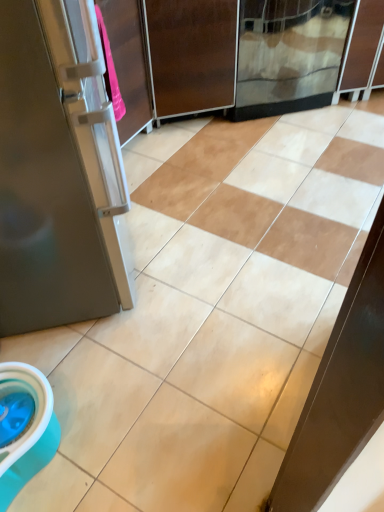
Find the location of `transparent glass screen door at upper center, the 2th screen door from the left`. transparent glass screen door at upper center, the 2th screen door from the left is located at coordinates (288, 55).

The image size is (384, 512). What do you see at coordinates (288, 55) in the screenshot? I see `transparent glass screen door at upper center, the 1th screen door positioned from the right` at bounding box center [288, 55].

In order to face transparent glass screen door at upper center, the 2th screen door from the left, should I rotate leftwards or rightwards?

Rotate right and turn 10.759 degrees.

Where is `brown matte screen door at center, placed as the 1th screen door when sorted from left to right`? This screenshot has height=512, width=384. brown matte screen door at center, placed as the 1th screen door when sorted from left to right is located at coordinates (192, 55).

Image resolution: width=384 pixels, height=512 pixels. Describe the element at coordinates (192, 55) in the screenshot. I see `brown matte screen door at center, arranged as the 2th screen door when viewed from the right` at that location.

Find the location of `transparent glass screen door at upper center, the 1th screen door positioned from the right`. transparent glass screen door at upper center, the 1th screen door positioned from the right is located at coordinates (288, 55).

From the picture: Is transparent glass screen door at upper center, the 1th screen door positioned from the right, at the right side of brown matte screen door at center, placed as the 1th screen door when sorted from left to right?

Yes, transparent glass screen door at upper center, the 1th screen door positioned from the right, is to the right of brown matte screen door at center, placed as the 1th screen door when sorted from left to right.

Considering the relative positions of transparent glass screen door at upper center, the 1th screen door positioned from the right, and brown matte screen door at center, arranged as the 2th screen door when viewed from the right, in the image provided, is transparent glass screen door at upper center, the 1th screen door positioned from the right, behind brown matte screen door at center, arranged as the 2th screen door when viewed from the right,?

Yes, the depth of transparent glass screen door at upper center, the 1th screen door positioned from the right, is greater than that of brown matte screen door at center, arranged as the 2th screen door when viewed from the right.

Is point (272, 25) farther from camera compared to point (214, 85)?

No, (272, 25) is in front of (214, 85).

From the image's perspective, does transparent glass screen door at upper center, the 1th screen door positioned from the right, appear higher than brown matte screen door at center, arranged as the 2th screen door when viewed from the right?

Yes, from the image's perspective, transparent glass screen door at upper center, the 1th screen door positioned from the right, is on top of brown matte screen door at center, arranged as the 2th screen door when viewed from the right.

From a real-world perspective, is transparent glass screen door at upper center, the 1th screen door positioned from the right, positioned above or below brown matte screen door at center, arranged as the 2th screen door when viewed from the right?

transparent glass screen door at upper center, the 1th screen door positioned from the right, is below brown matte screen door at center, arranged as the 2th screen door when viewed from the right.

Is transparent glass screen door at upper center, the 1th screen door positioned from the right, wider than brown matte screen door at center, arranged as the 2th screen door when viewed from the right?

No, transparent glass screen door at upper center, the 1th screen door positioned from the right, is not wider than brown matte screen door at center, arranged as the 2th screen door when viewed from the right.

Looking at this image, is transparent glass screen door at upper center, the 1th screen door positioned from the right, taller than brown matte screen door at center, placed as the 1th screen door when sorted from left to right?

In fact, transparent glass screen door at upper center, the 1th screen door positioned from the right, may be shorter than brown matte screen door at center, placed as the 1th screen door when sorted from left to right.

Who is bigger, transparent glass screen door at upper center, the 2th screen door from the left, or brown matte screen door at center, arranged as the 2th screen door when viewed from the right?

Bigger between the two is transparent glass screen door at upper center, the 2th screen door from the left.

Is brown matte screen door at center, arranged as the 2th screen door when viewed from the right, inside transparent glass screen door at upper center, the 2th screen door from the left?

That's incorrect, brown matte screen door at center, arranged as the 2th screen door when viewed from the right, is not inside transparent glass screen door at upper center, the 2th screen door from the left.

Is transparent glass screen door at upper center, the 1th screen door positioned from the right, positioned far away from brown matte screen door at center, arranged as the 2th screen door when viewed from the right?

transparent glass screen door at upper center, the 1th screen door positioned from the right, is actually quite close to brown matte screen door at center, arranged as the 2th screen door when viewed from the right.

Is transparent glass screen door at upper center, the 1th screen door positioned from the right, turned away from brown matte screen door at center, arranged as the 2th screen door when viewed from the right?

No.

I want to click on screen door on the right of brown matte screen door at center, placed as the 1th screen door when sorted from left to right, so click(288, 55).

Which is more to the left, brown matte screen door at center, placed as the 1th screen door when sorted from left to right, or transparent glass screen door at upper center, the 2th screen door from the left?

brown matte screen door at center, placed as the 1th screen door when sorted from left to right.

Which object is more forward, brown matte screen door at center, placed as the 1th screen door when sorted from left to right, or transparent glass screen door at upper center, the 1th screen door positioned from the right?

brown matte screen door at center, placed as the 1th screen door when sorted from left to right, is closer to the camera.

Is point (146, 10) more distant than point (260, 15)?

No, it is in front of (260, 15).

From the image's perspective, which one is positioned lower, brown matte screen door at center, arranged as the 2th screen door when viewed from the right, or transparent glass screen door at upper center, the 2th screen door from the left?

brown matte screen door at center, arranged as the 2th screen door when viewed from the right, from the image's perspective.

From a real-world perspective, is brown matte screen door at center, placed as the 1th screen door when sorted from left to right, on transparent glass screen door at upper center, the 1th screen door positioned from the right?

Correct, in the physical world, brown matte screen door at center, placed as the 1th screen door when sorted from left to right, is higher than transparent glass screen door at upper center, the 1th screen door positioned from the right.

Does brown matte screen door at center, arranged as the 2th screen door when viewed from the right, have a greater width compared to transparent glass screen door at upper center, the 1th screen door positioned from the right?

Yes, brown matte screen door at center, arranged as the 2th screen door when viewed from the right, is wider than transparent glass screen door at upper center, the 1th screen door positioned from the right.

Which of these two, brown matte screen door at center, placed as the 1th screen door when sorted from left to right, or transparent glass screen door at upper center, the 2th screen door from the left, stands shorter?

transparent glass screen door at upper center, the 2th screen door from the left.

Does brown matte screen door at center, arranged as the 2th screen door when viewed from the right, have a smaller size compared to transparent glass screen door at upper center, the 1th screen door positioned from the right?

Yes.

Do you think brown matte screen door at center, placed as the 1th screen door when sorted from left to right, is within transparent glass screen door at upper center, the 1th screen door positioned from the right, or outside of it?

brown matte screen door at center, placed as the 1th screen door when sorted from left to right, cannot be found inside transparent glass screen door at upper center, the 1th screen door positioned from the right.

Is brown matte screen door at center, placed as the 1th screen door when sorted from left to right, far away from transparent glass screen door at upper center, the 1th screen door positioned from the right?

No, brown matte screen door at center, placed as the 1th screen door when sorted from left to right, is in close proximity to transparent glass screen door at upper center, the 1th screen door positioned from the right.

Is transparent glass screen door at upper center, the 2th screen door from the left, at the back of brown matte screen door at center, arranged as the 2th screen door when viewed from the right?

brown matte screen door at center, arranged as the 2th screen door when viewed from the right, does not have its back to transparent glass screen door at upper center, the 2th screen door from the left.

At what (x,y) coordinates should I click in order to perform the action: click on screen door on the left side of transparent glass screen door at upper center, the 2th screen door from the left. Please return your answer as a coordinate pair (x, y). Looking at the image, I should click on (192, 55).

The height and width of the screenshot is (512, 384). Find the location of `screen door located on the right of brown matte screen door at center, placed as the 1th screen door when sorted from left to right`. screen door located on the right of brown matte screen door at center, placed as the 1th screen door when sorted from left to right is located at coordinates (288, 55).

The height and width of the screenshot is (512, 384). Identify the location of screen door above the transparent glass screen door at upper center, the 2th screen door from the left (from a real-world perspective). (192, 55).